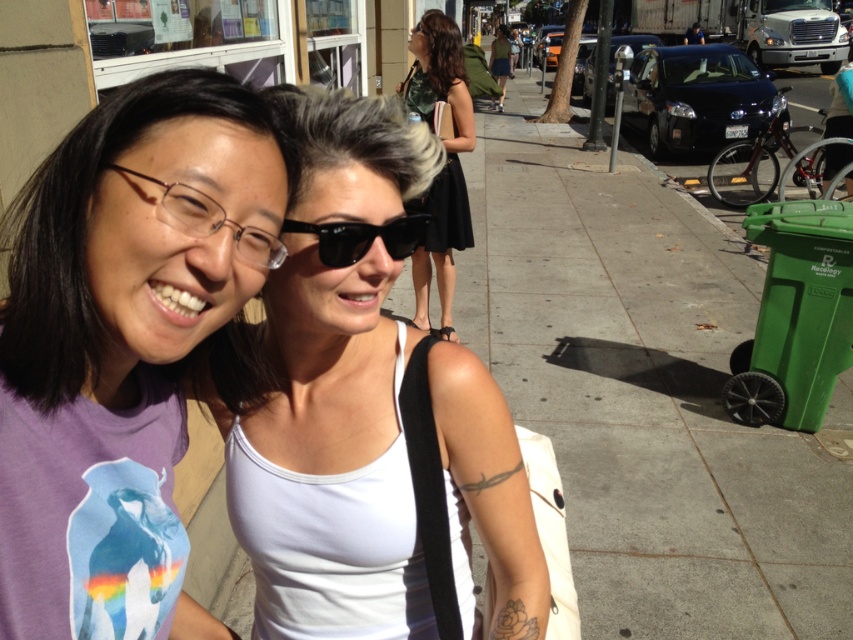
Question: Which object is the closest to the white matte tank top at center?

Choices:
 (A) black plastic sunglasses at center
 (B) purple matte t-shirt at center
 (C) green plastic trash can at right

Answer: (B)

Question: Is green plastic trash can at right wider than white matte tank top at center?

Choices:
 (A) yes
 (B) no

Answer: (A)

Question: Is green plastic trash can at right below green textured dress at upper center?

Choices:
 (A) yes
 (B) no

Answer: (B)

Question: Where is green textured dress at upper center located in relation to black plastic sunglasses at center in the image?

Choices:
 (A) below
 (B) above

Answer: (B)

Question: Which object is farther from the camera taking this photo?

Choices:
 (A) green textured dress at upper center
 (B) purple matte t-shirt at center
 (C) green plastic trash can at right

Answer: (A)

Question: Among these objects, which one is nearest to the camera?

Choices:
 (A) black plastic sunglasses at center
 (B) green textured dress at upper center

Answer: (A)